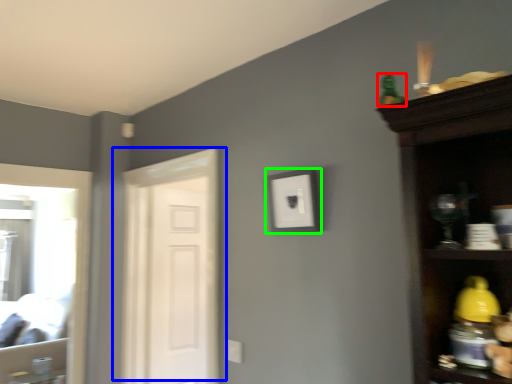
Question: Which is nearer to the toy (highlighted by a red box)? door (highlighted by a blue box) or picture frame (highlighted by a green box).

Choices:
 (A) door
 (B) picture frame

Answer: (B)